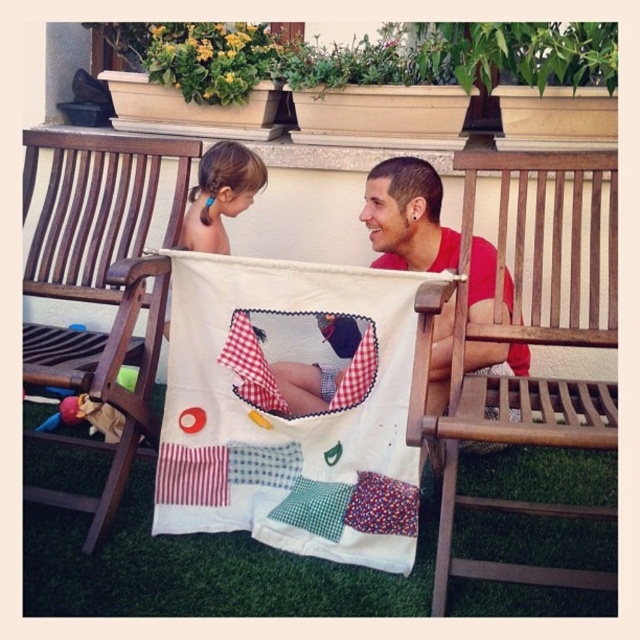
Between wooden at right and blonde hair at upper left, which one is positioned lower?

wooden at right is below.

Does point (538, 168) come in front of point (184, 227)?

Yes, it is in front of point (184, 227).

Is point (518, 400) closer to camera compared to point (205, 172)?

Yes.

Where is `wooden at right`? wooden at right is located at coordinates (536, 344).

Consider the image. How much distance is there between wooden at right and wooden park bench at left?

→ wooden at right is 1.34 meters away from wooden park bench at left.

You are a GUI agent. You are given a task and a screenshot of the screen. Output one action in this format:
    pyautogui.click(x=<x>, y=<y>)
    Task: Click on the wooden at right
    This screenshot has width=640, height=640.
    Given the screenshot: What is the action you would take?
    pyautogui.click(x=536, y=344)

Is point (612, 328) closer to camera compared to point (116, 209)?

Yes, point (612, 328) is in front of point (116, 209).

Where is `wooden at right`? The height and width of the screenshot is (640, 640). wooden at right is located at coordinates [x=536, y=344].

Is patchwork fabric quilt at center smaller than wooden at right?

Indeed, patchwork fabric quilt at center has a smaller size compared to wooden at right.

Does patchwork fabric quilt at center have a larger size compared to wooden at right?

No, patchwork fabric quilt at center is not bigger than wooden at right.

Consider the image. Who is more distant from viewer, [168,492] or [452,380]?

Point [168,492]

At what (x,y) coordinates should I click in order to perform the action: click on patchwork fabric quilt at center. Please return your answer as a coordinate pair (x, y). The height and width of the screenshot is (640, 640). Looking at the image, I should click on (288, 412).